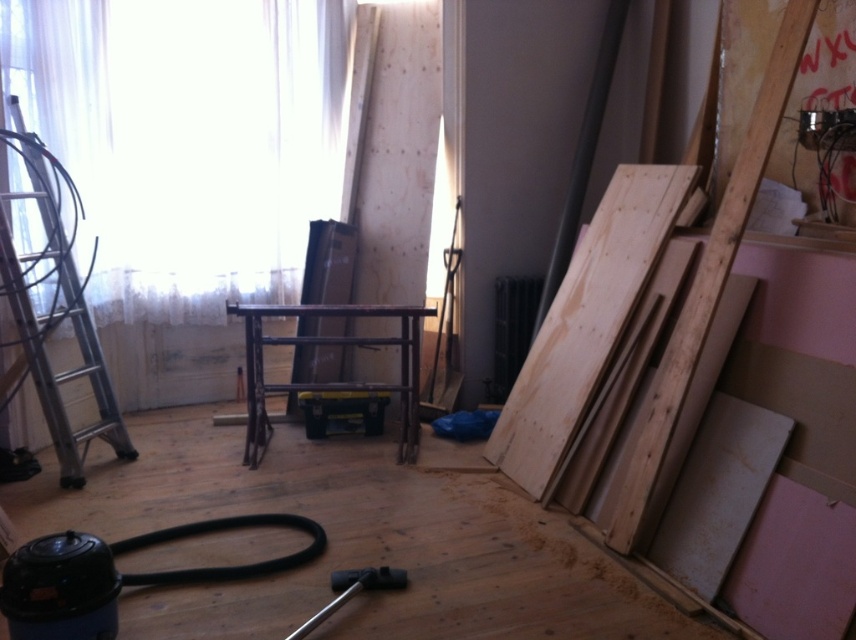
Can you confirm if white sheer curtain at upper left is positioned below natural wood plywood at right?

Incorrect, white sheer curtain at upper left is not positioned below natural wood plywood at right.

Who is higher up, white sheer curtain at upper left or natural wood plywood at right?

white sheer curtain at upper left is above.

Which is in front, point (108, 13) or point (545, 358)?

Point (545, 358) is in front.

Find the location of a particular element. white sheer curtain at upper left is located at coordinates (186, 140).

Can you confirm if white sheer curtain at upper left is positioned above silver metallic ladder at left?

Correct, white sheer curtain at upper left is located above silver metallic ladder at left.

Is white sheer curtain at upper left below silver metallic ladder at left?

No.

Image resolution: width=856 pixels, height=640 pixels. Find the location of `white sheer curtain at upper left`. white sheer curtain at upper left is located at coordinates coord(186,140).

Identify the location of natural wood plywood at right. The image size is (856, 640). (586, 321).

Which of these two, natural wood plywood at right or silver metallic ladder at left, stands taller?

silver metallic ladder at left

Describe the element at coordinates (586, 321) in the screenshot. I see `natural wood plywood at right` at that location.

In order to click on natural wood plywood at right in this screenshot , I will do `click(586, 321)`.